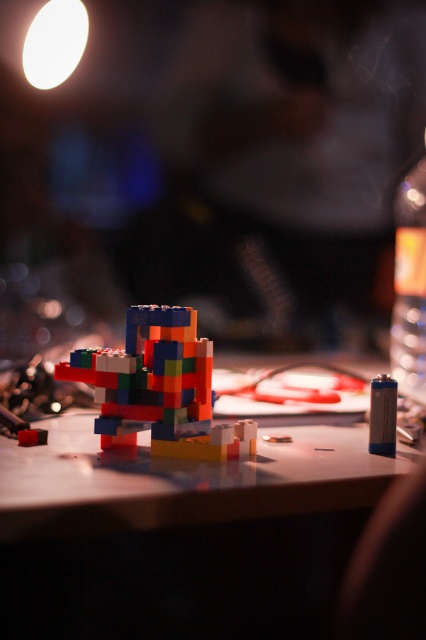
You are setting up a display for a toy store. You have a matte plastic table at center and a multicolored plastic toy at center. The store manager wants to know if the distance between them is sufficient for customers to comfortably walk around. Can you confirm if the distance is at least 15 centimeters?

The matte plastic table at center is only 12.35 centimeters from the multicolored plastic toy at center, which is less than the required 15 centimeters. Therefore, the distance is insufficient for customers to comfortably walk around.

You are a small robot with a height of 24 inches. You are standing on the table where the LEGO structure is placed. Can you safely walk towards the point at coordinates point (118, 365) without hitting your head?

The point (118, 365) is 26.15 inches away from the viewer. Since the robot is 24 inches tall, it can safely walk towards the point as the height clearance is sufficient.

You are placing a LEGO figure on the matte plastic table at center. If you want to position it precisely at the coordinates mentioned in the description, where should you place it?

The matte plastic table at center should be placed at coordinates point (183, 534) as specified in the description.